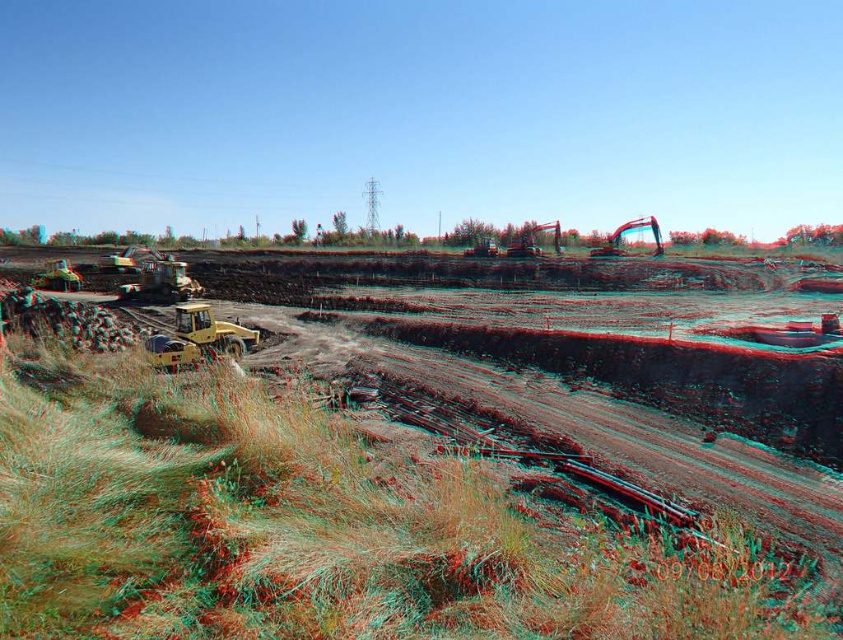
Does yellow rubber at center have a greater height compared to metallic yellow excavator at center right?

In fact, yellow rubber at center may be shorter than metallic yellow excavator at center right.

Who is taller, yellow rubber at center or metallic yellow excavator at center right?

With more height is metallic yellow excavator at center right.

Image resolution: width=843 pixels, height=640 pixels. I want to click on yellow rubber at center, so click(415, 486).

Which is below, yellow rubber excavator at lower left or metallic yellow excavator at center right?

yellow rubber excavator at lower left is lower down.

Is yellow rubber excavator at lower left shorter than metallic yellow excavator at center right?

Yes, yellow rubber excavator at lower left is shorter than metallic yellow excavator at center right.

At what (x,y) coordinates should I click in order to perform the action: click on yellow rubber excavator at lower left. Please return your answer as a coordinate pair (x, y). The image size is (843, 640). Looking at the image, I should click on (197, 339).

Locate an element on the screen. yellow rubber excavator at lower left is located at coordinates (197, 339).

Can you confirm if yellow rubber at center is taller than yellow rubber excavator at lower left?

Correct, yellow rubber at center is much taller as yellow rubber excavator at lower left.

Consider the image. Who is more forward, (374,417) or (202,324)?

Point (374,417) is in front.

Does point (254, 609) lie behind point (207, 308)?

No, (254, 609) is in front of (207, 308).

Locate an element on the screen. This screenshot has width=843, height=640. yellow rubber at center is located at coordinates (415, 486).